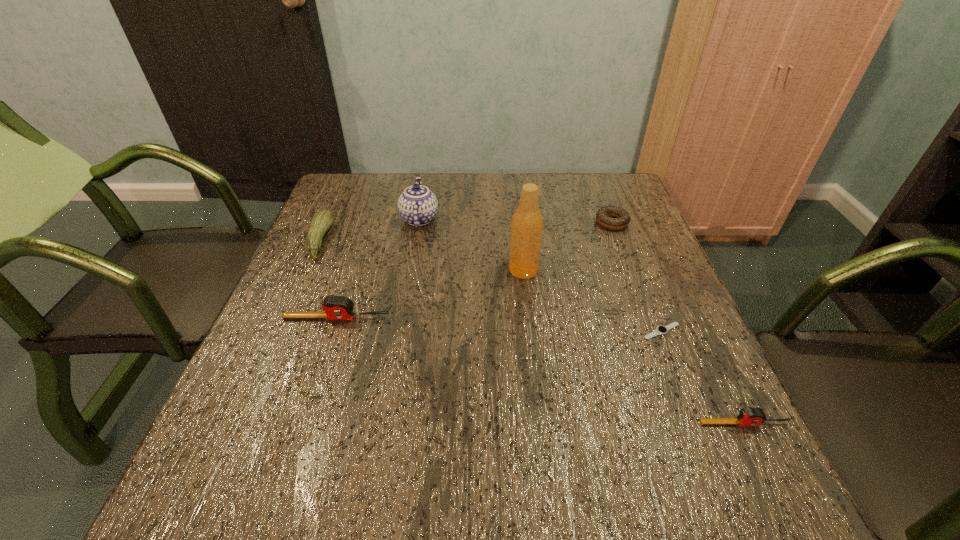
Image resolution: width=960 pixels, height=540 pixels. I want to click on the taller tape measure, so click(x=335, y=307).

The width and height of the screenshot is (960, 540). I want to click on the left tape measure, so click(x=335, y=307).

Where is `the nearer tape measure`? the nearer tape measure is located at coordinates (749, 416).

This screenshot has height=540, width=960. Identify the location of the shorter tape measure. (749, 416).

Identify the location of the sixth shortest object. The width and height of the screenshot is (960, 540). (417, 205).

Locate an element on the screen. Image resolution: width=960 pixels, height=540 pixels. the second shortest object is located at coordinates (604, 215).

Locate an element on the screen. The width and height of the screenshot is (960, 540). zucchini is located at coordinates (321, 222).

The width and height of the screenshot is (960, 540). What are the coordinates of `watch` in the screenshot? It's located at (660, 330).

Identify the location of the fourth object from right to left. (527, 221).

Where is `the tallest object`? the tallest object is located at coordinates (527, 221).